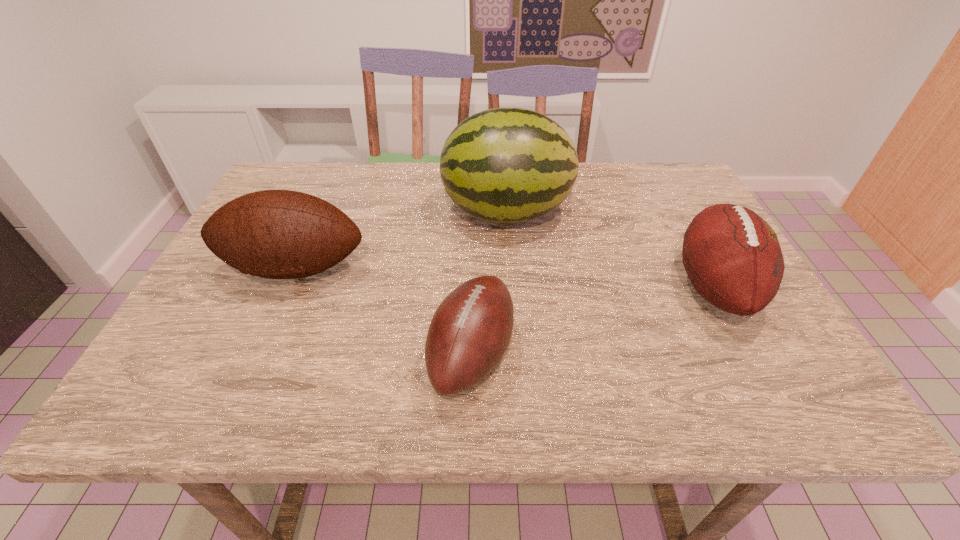
This screenshot has height=540, width=960. I want to click on vacant region located on the back of the second football (American) from right to left, so click(x=473, y=285).

Where is `object that is at the far edge`? This screenshot has width=960, height=540. object that is at the far edge is located at coordinates (503, 165).

The width and height of the screenshot is (960, 540). Identify the location of object present at the near edge. (470, 331).

This screenshot has width=960, height=540. Identify the location of object at the left edge. (279, 234).

The height and width of the screenshot is (540, 960). Identify the location of object situated at the right edge. (732, 256).

Where is `vacant space at the far edge of the desktop`? This screenshot has width=960, height=540. vacant space at the far edge of the desktop is located at coordinates (370, 199).

Where is `vacant area at the near edge of the desktop`? This screenshot has width=960, height=540. vacant area at the near edge of the desktop is located at coordinates (249, 397).

Image resolution: width=960 pixels, height=540 pixels. In order to click on free space at the left edge of the desktop in this screenshot , I will do `click(225, 289)`.

Find the location of `free location at the right edge of the desktop`. free location at the right edge of the desktop is located at coordinates (713, 346).

The image size is (960, 540). In order to click on vacant area at the far left corner in this screenshot , I will do `click(291, 182)`.